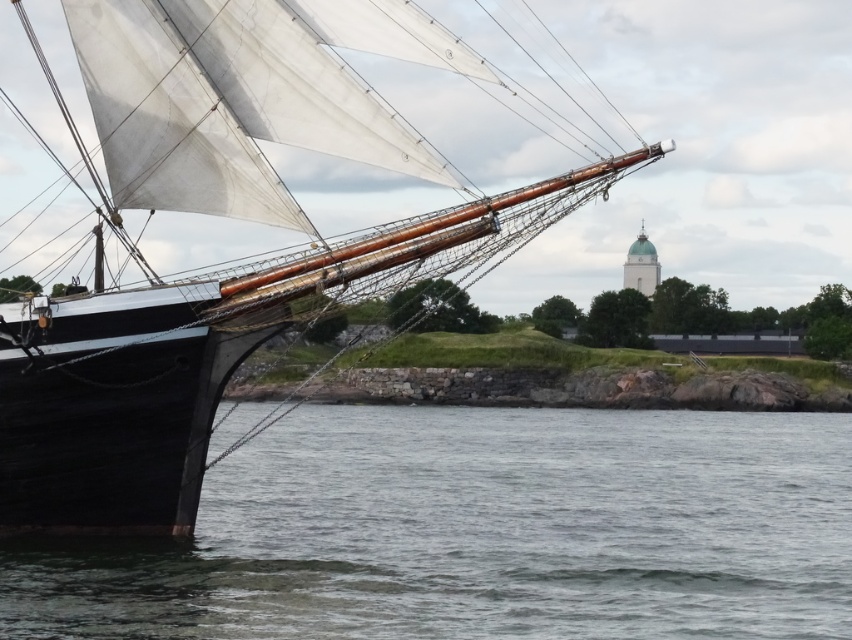
Question: In this image, where is clear water at lower left located relative to white canvas sail at left?

Choices:
 (A) above
 (B) below

Answer: (B)

Question: Does clear water at lower left have a greater width compared to white canvas sail at left?

Choices:
 (A) no
 (B) yes

Answer: (B)

Question: Is clear water at lower left thinner than white canvas sail at left?

Choices:
 (A) no
 (B) yes

Answer: (A)

Question: Which point is closer to the camera?

Choices:
 (A) (589, 636)
 (B) (337, 241)

Answer: (B)